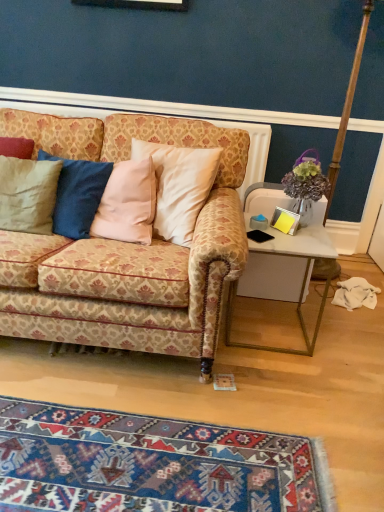
At what (x,y) coordinates should I click in order to perform the action: click on free space above white glossy desk at right (from a real-world perspective). Please return your answer as a coordinate pair (x, y). This screenshot has width=384, height=512. Looking at the image, I should click on (284, 236).